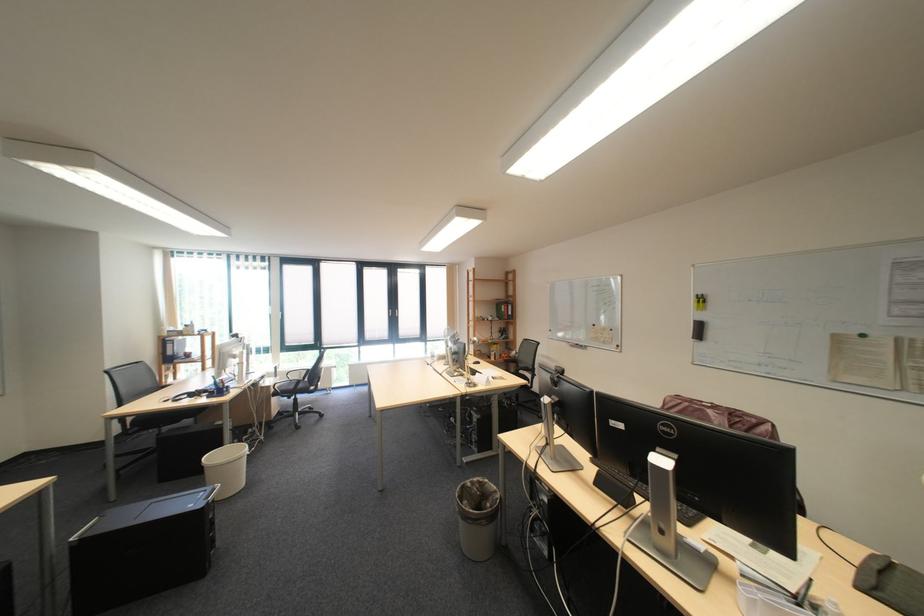
Describe the element at coordinates (650, 493) in the screenshot. I see `the black computer keyboard` at that location.